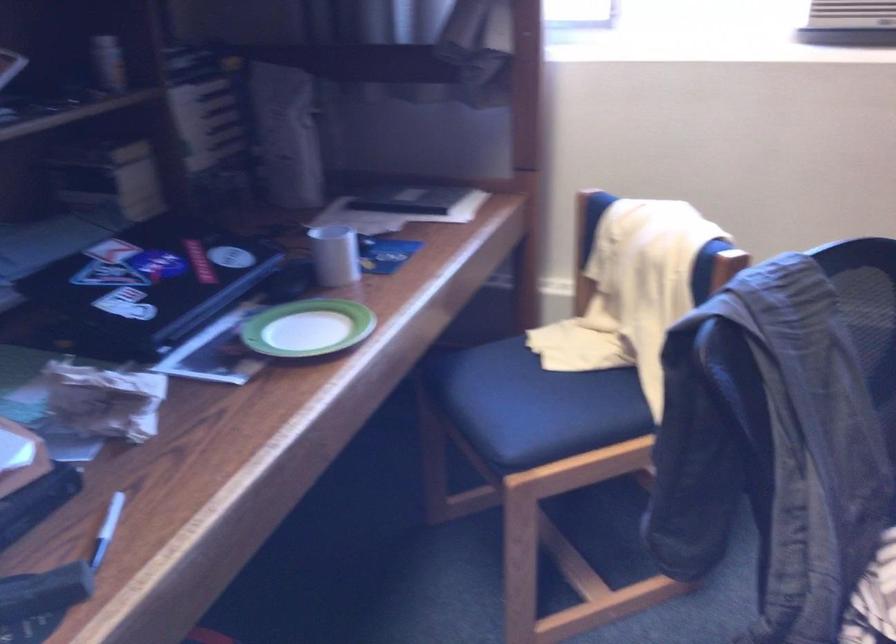
Where is `white paper cup`? white paper cup is located at coordinates (334, 254).